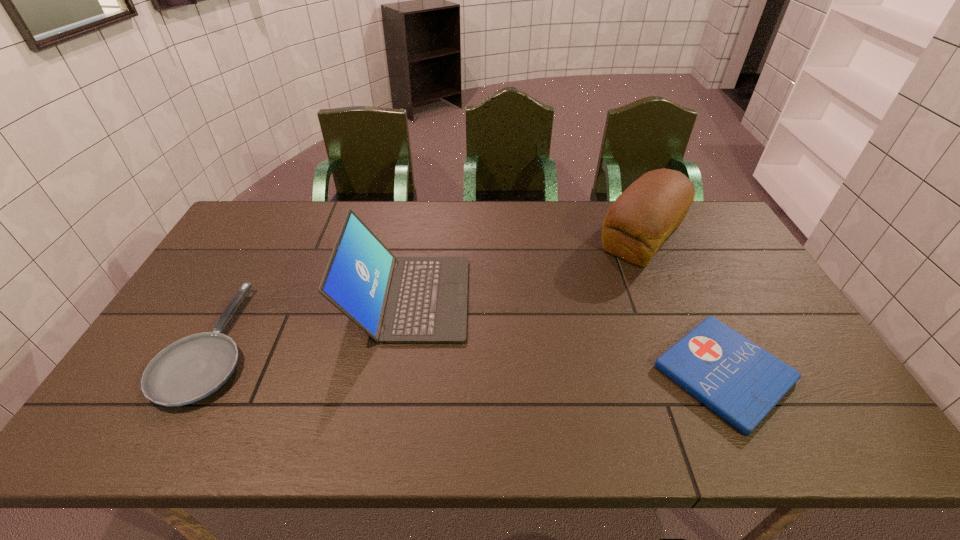
This screenshot has height=540, width=960. Identify the location of bread. point(639,221).

The width and height of the screenshot is (960, 540). Find the location of `laptop computer`. laptop computer is located at coordinates (406, 299).

Identify the location of frying pan. (192, 368).

Locate an element on the screen. The image size is (960, 540). the leftmost object is located at coordinates (192, 368).

This screenshot has height=540, width=960. Identify the location of the shortest object. (738, 380).

At what (x,y) coordinates should I click in order to perform the action: click on free spot located on the left of the bread. Please return your answer as a coordinate pair (x, y). Looking at the image, I should click on (526, 238).

Identify the location of free location located 0.320m on the screen of the laptop computer. (577, 298).

Locate an element on the screen. vacant point located on the back of the frying pan is located at coordinates (x=276, y=230).

Find the location of a particular element. free space located on the left of the shortest object is located at coordinates (533, 373).

Where is `object positioned at the far edge`? The width and height of the screenshot is (960, 540). object positioned at the far edge is located at coordinates (639, 221).